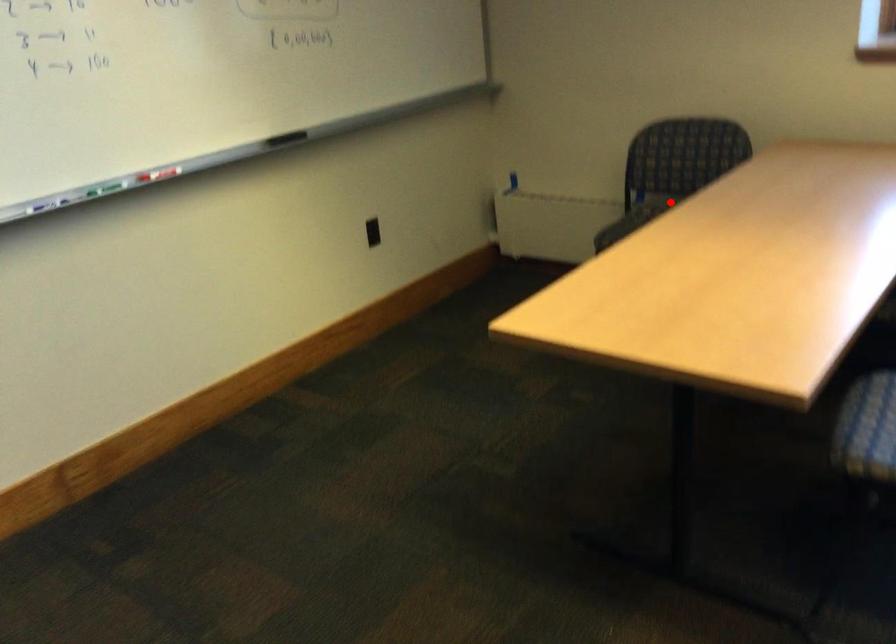
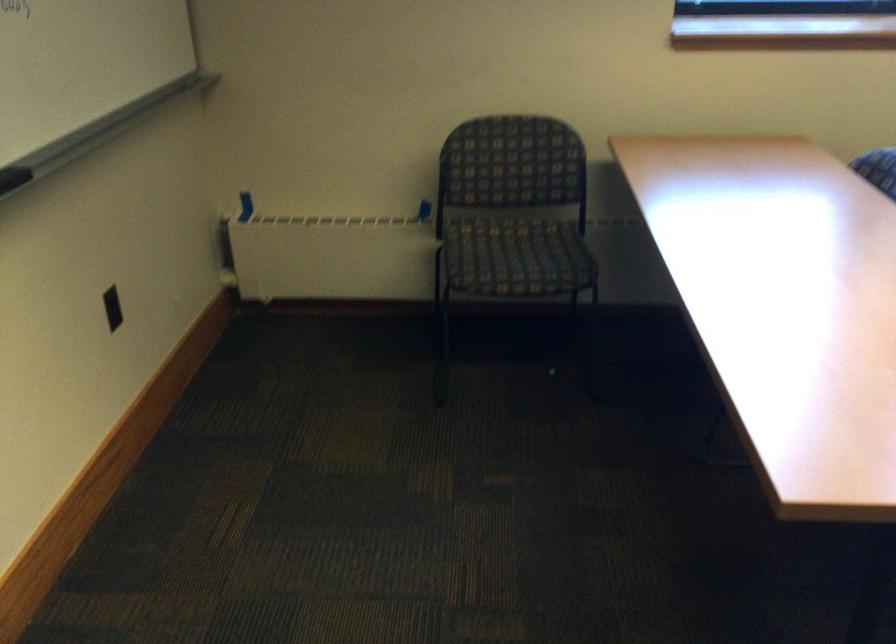
Find the pixel in the second image that matches the highlighted location in the first image.

(488, 220)